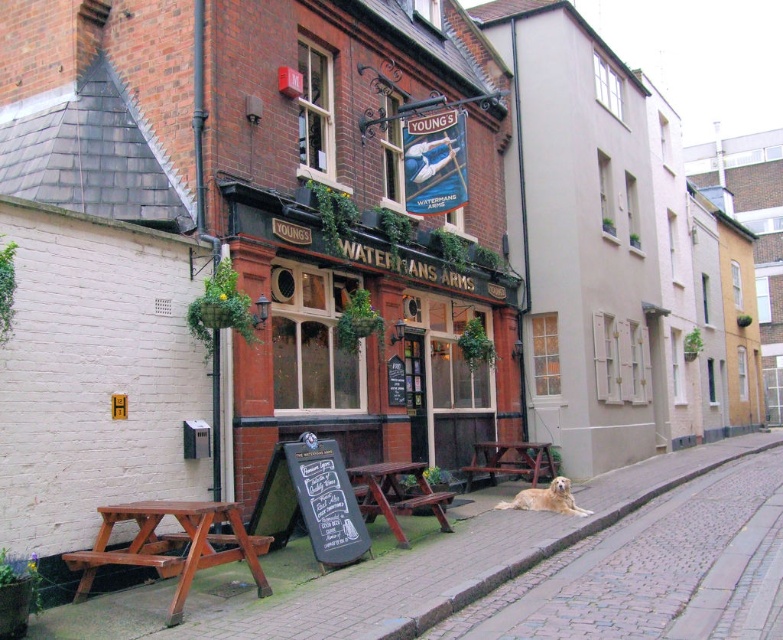
Question: Which object is farther from the camera taking this photo?

Choices:
 (A) brown wooden picnic table at center
 (B) brown wooden pavement at lower left

Answer: (A)

Question: Does cobblestone pavement at lower right appear under wooden picnic table at center?

Choices:
 (A) yes
 (B) no

Answer: (A)

Question: Which point is closer to the camera taking this photo?

Choices:
 (A) (543, 508)
 (B) (540, 460)

Answer: (A)

Question: Which object is positioned farthest from the wooden picnic table at center?

Choices:
 (A) golden matte dog at lower right
 (B) wooden picnic table at lower left
 (C) brown wooden picnic table at center

Answer: (C)

Question: From the image, what is the correct spatial relationship of brown wooden pavement at lower left in relation to cobblestone pavement at lower right?

Choices:
 (A) left
 (B) right

Answer: (A)

Question: Is brown wooden pavement at lower left to the right of cobblestone pavement at lower right from the viewer's perspective?

Choices:
 (A) yes
 (B) no

Answer: (B)